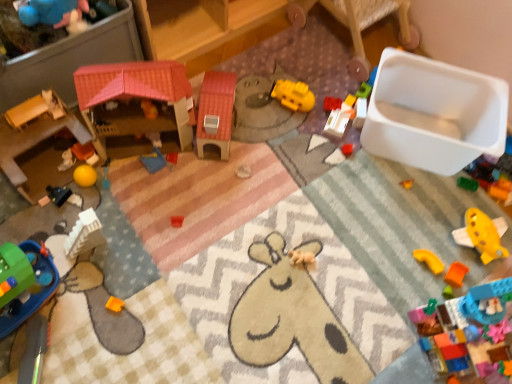
Where is `free area in between yellow matte plastic toy at center, which is the 8th toy from left to right, and blue plastic tray at center, which ranks as the 10th toy in right-to-left order`? The height and width of the screenshot is (384, 512). free area in between yellow matte plastic toy at center, which is the 8th toy from left to right, and blue plastic tray at center, which ranks as the 10th toy in right-to-left order is located at coordinates (239, 131).